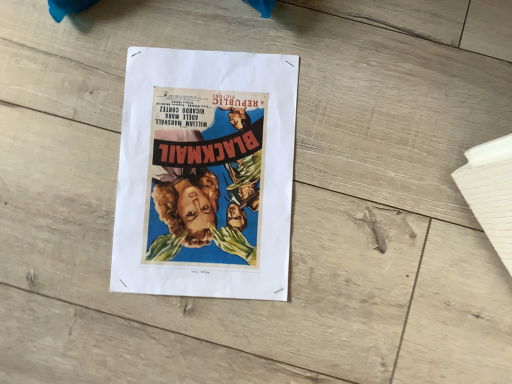
Identify the location of vacant point above colorful paper poster at center (from a real-world perspective). (205, 170).